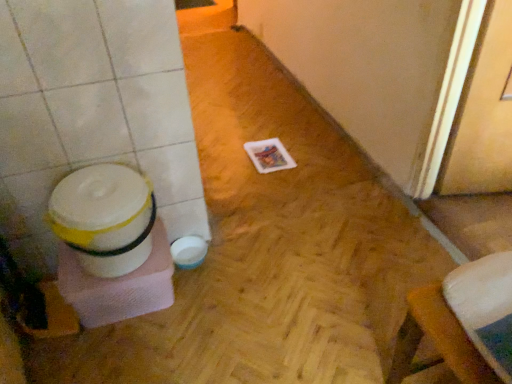
Question: From the image's perspective, is white plastic potty at left above wooden screen door at right?

Choices:
 (A) no
 (B) yes

Answer: (A)

Question: From a real-world perspective, is white plastic potty at left on wooden screen door at right?

Choices:
 (A) no
 (B) yes

Answer: (A)

Question: Is white plastic potty at left to the right of wooden screen door at right from the viewer's perspective?

Choices:
 (A) no
 (B) yes

Answer: (A)

Question: From a real-world perspective, is white plastic potty at left under wooden screen door at right?

Choices:
 (A) no
 (B) yes

Answer: (B)

Question: Is white plastic potty at left facing towards wooden screen door at right?

Choices:
 (A) no
 (B) yes

Answer: (A)

Question: Is white plastic potty at left wider than wooden screen door at right?

Choices:
 (A) no
 (B) yes

Answer: (B)

Question: Is wooden screen door at right completely or partially outside of white plastic potty at left?

Choices:
 (A) no
 (B) yes

Answer: (B)

Question: Is the position of wooden screen door at right more distant than that of white plastic potty at left?

Choices:
 (A) yes
 (B) no

Answer: (B)

Question: Is wooden screen door at right at the left side of white plastic potty at left?

Choices:
 (A) no
 (B) yes

Answer: (A)

Question: Considering the relative positions of wooden screen door at right and white plastic potty at left in the image provided, is wooden screen door at right in front of white plastic potty at left?

Choices:
 (A) no
 (B) yes

Answer: (B)

Question: Considering the relative sizes of wooden screen door at right and white plastic potty at left in the image provided, is wooden screen door at right wider than white plastic potty at left?

Choices:
 (A) yes
 (B) no

Answer: (B)

Question: Is white plastic potty at left surrounded by wooden screen door at right?

Choices:
 (A) no
 (B) yes

Answer: (A)

Question: In terms of height, does wooden screen door at right look taller or shorter compared to white plastic potty at left?

Choices:
 (A) tall
 (B) short

Answer: (A)